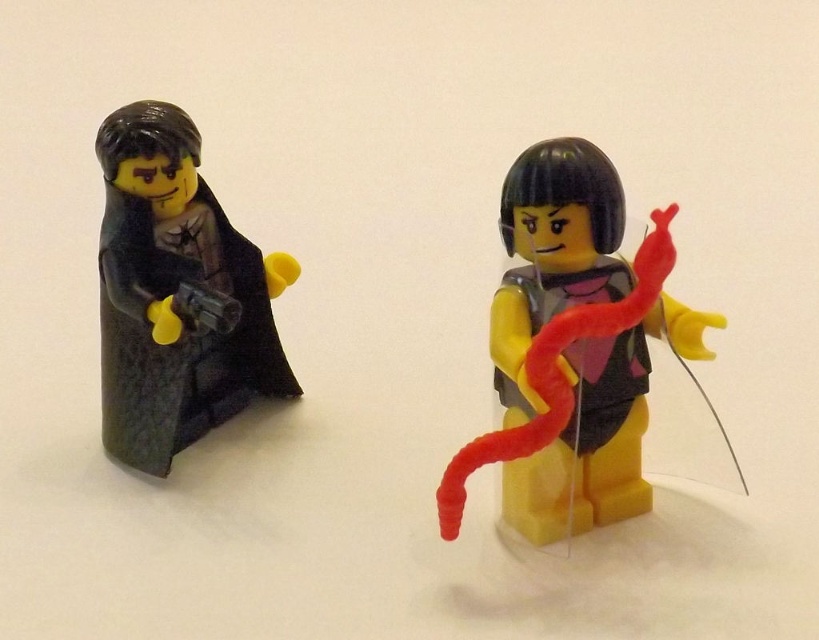
Is matte black minifigure at center thinner than matte black cape at left?

Incorrect, matte black minifigure at center's width is not less than matte black cape at left's.

In the scene shown: Which is below, matte black minifigure at center or matte black cape at left?

Positioned lower is matte black minifigure at center.

Between point (560, 266) and point (166, 449), which one is positioned in front?

Positioned in front is point (560, 266).

Locate an element on the screen. matte black minifigure at center is located at coordinates (572, 348).